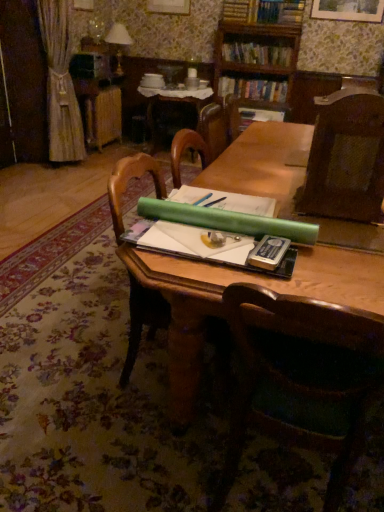
Question: From a real-world perspective, is matte white lampshade at upper left above or below hardcover book at upper center, marked as the second book in a bottom-to-top arrangement?

Choices:
 (A) above
 (B) below

Answer: (B)

Question: From their relative heights in the image, would you say matte white lampshade at upper left is taller or shorter than hardcover book at upper center, marked as the second book in a bottom-to-top arrangement?

Choices:
 (A) tall
 (B) short

Answer: (A)

Question: Estimate the real-world distances between objects in this image. Which object is farther from the gold textured curtain at left?

Choices:
 (A) hardcover book at upper center, acting as the 1th book starting from the top
 (B) wooden bookcase at upper center
 (C) wooden table at center, the first table when ordered from back to front
 (D) wooden table at center, which ranks as the 1th table in front-to-back order
 (E) metallic silver paperback book at center

Answer: (E)

Question: Which object is the farthest from the matte white lampshade at upper left?

Choices:
 (A) gold textured curtain at left
 (B) hardcover book at upper center, marked as the second book in a top-to-bottom arrangement
 (C) wooden bookcase at upper center
 (D) brown textured chair at right, the first chair from the top
 (E) wooden chair at center, which is the first chair in bottom-to-top order

Answer: (E)